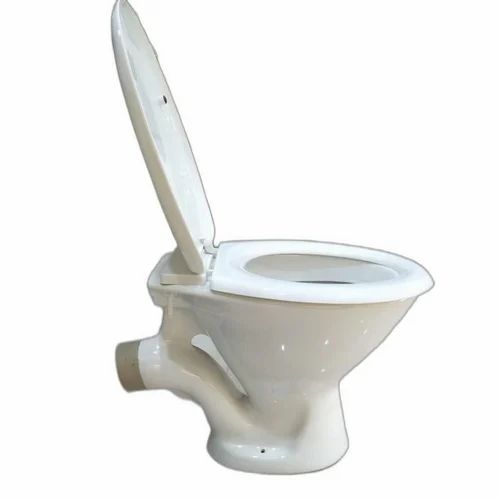
I want to click on reflection on toilet, so click(x=322, y=342), click(x=316, y=378), click(x=367, y=332), click(x=359, y=319), click(x=287, y=348), click(x=156, y=352), click(x=403, y=303).